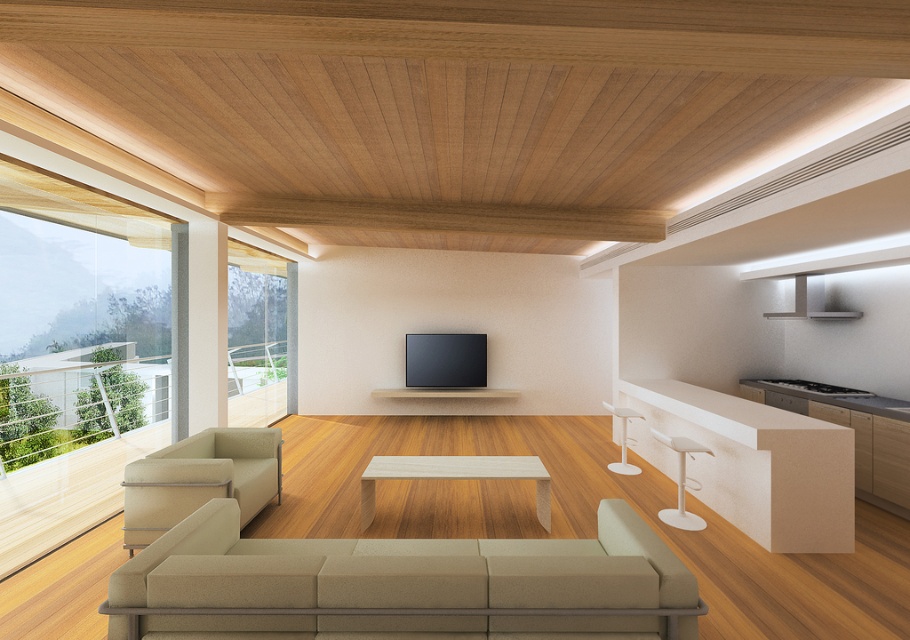
You are standing at point [623,444] and want to move to the entrance located at the far wall. There is an obstacle at point [666,522]. Can you walk straight ahead without passing by the obstacle?

Point [666,522] is in front of point [623,444], so walking straight ahead would require passing by the obstacle at point [666,522].

From the picture: You are sitting on the beige fabric armchair at left and want to reach the white plastic bar stool at right. Which direction should you move to get closer to the stool?

The beige fabric armchair at left is above the white plastic bar stool at right, so you should move downward to get closer to the stool.

You are a delivery person trying to move a large package through the living room. The package is 3.5 feet wide. There are two white bar stools at the right side of the room. Can you pass between the white plastic bar stool at right and the white glossy bar stool at right with the package?

The distance between the white plastic bar stool at right and the white glossy bar stool at right is 4.00 feet. Since the package is 3.5 feet wide, it should fit between them as 3.5 is less than 4.00.